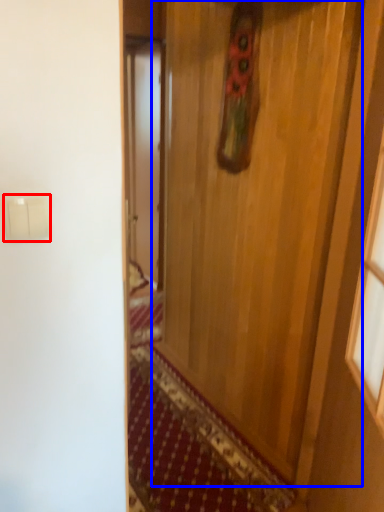
Question: Among these objects, which one is farthest to the camera, light switch (highlighted by a red box) or door (highlighted by a blue box)?

Choices:
 (A) light switch
 (B) door

Answer: (B)